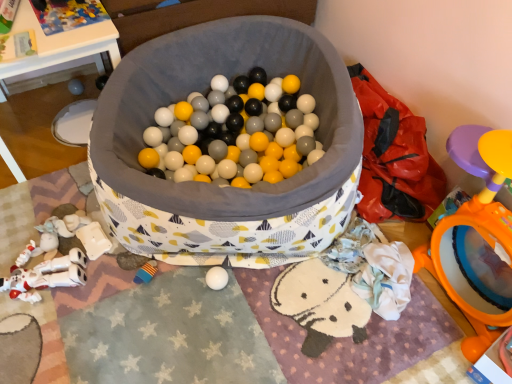
Question: From their relative heights in the image, would you say orange plastic mirror at right, acting as the 3th toy starting from the top, is taller or shorter than matte gray ball at left, which is the fifth toy from right to left?

Choices:
 (A) tall
 (B) short

Answer: (A)

Question: From a real-world perspective, relative to matte gray ball at left, arranged as the second toy when viewed from the top, is orange plastic mirror at right, acting as the first toy starting from the front, vertically above or below?

Choices:
 (A) below
 (B) above

Answer: (B)

Question: Considering the real-world distances, which object is closest to the matte gray ball at left, which appears as the fifth toy when viewed from the front?

Choices:
 (A) fabric-lined ball pit at center
 (B) plastic colorful puzzle pieces at upper left, the first toy in the top-to-bottom sequence
 (C) white plush toy at lower left, which is the 4th toy in top-to-bottom order
 (D) soft plush toy at lower left, which appears as the first toy when ordered from the bottom
 (E) orange plastic mirror at right, acting as the first toy starting from the front

Answer: (B)

Question: Considering the real-world distances, which object is farthest from the white plush toy at lower left, the second toy positioned from the bottom?

Choices:
 (A) matte gray ball at left, which is the fifth toy from right to left
 (B) orange plastic mirror at right, arranged as the 3th toy when ordered from the bottom
 (C) soft plush toy at lower left, the third toy viewed from the back
 (D) fabric-lined ball pit at center
 (E) plastic colorful puzzle pieces at upper left, positioned as the third toy in right-to-left order

Answer: (B)